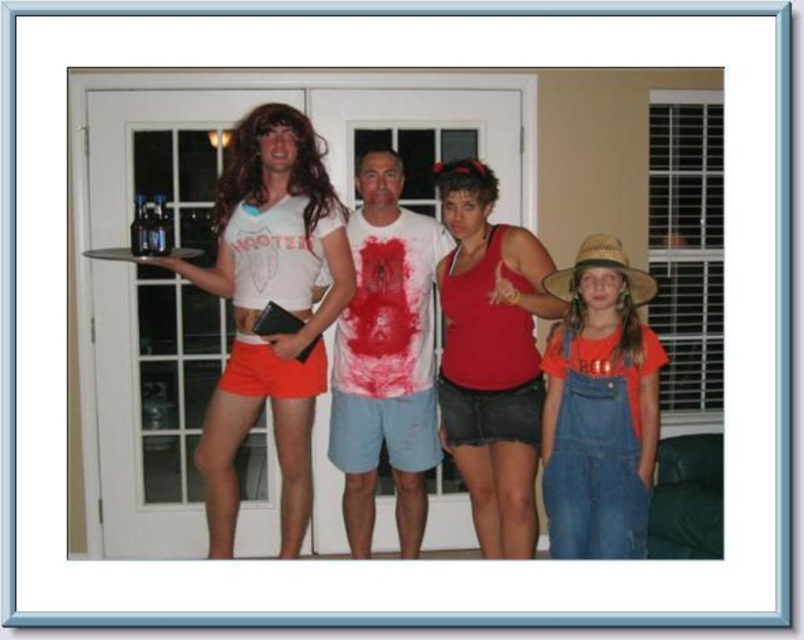
Does red matte tank top at center come in front of denim overalls at right?

That is False.

You are a GUI agent. You are given a task and a screenshot of the screen. Output one action in this format:
    pyautogui.click(x=<x>, y=<y>)
    Task: Click on the red matte tank top at center
    
    Given the screenshot: What is the action you would take?
    pyautogui.click(x=491, y=356)

Locate an element on the screen. This screenshot has width=804, height=640. red matte tank top at center is located at coordinates (491, 356).

Which is more to the left, white cotton t-shirt at center or denim overalls at right?

Positioned to the left is white cotton t-shirt at center.

Describe the element at coordinates (386, 358) in the screenshot. This screenshot has width=804, height=640. I see `white cotton t-shirt at center` at that location.

Is point (396, 157) positioned after point (626, 548)?

Yes, point (396, 157) is behind point (626, 548).

Find the location of `white cotton t-shirt at center`. white cotton t-shirt at center is located at coordinates (386, 358).

Does point (466, 275) lie behind point (361, 424)?

No, it is in front of (361, 424).

Is red matte tank top at center positioned before white cotton t-shirt at center?

Yes, red matte tank top at center is in front of white cotton t-shirt at center.

Is point (470, 410) positioned in front of point (368, 480)?

Yes.

At what (x,y) coordinates should I click in order to perform the action: click on red matte tank top at center. Please return your answer as a coordinate pair (x, y). Looking at the image, I should click on (491, 356).